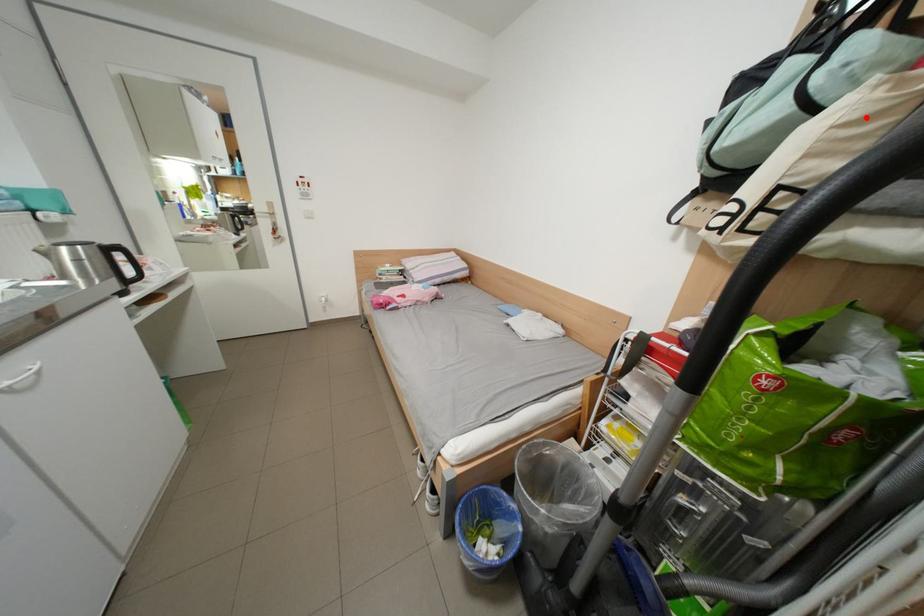
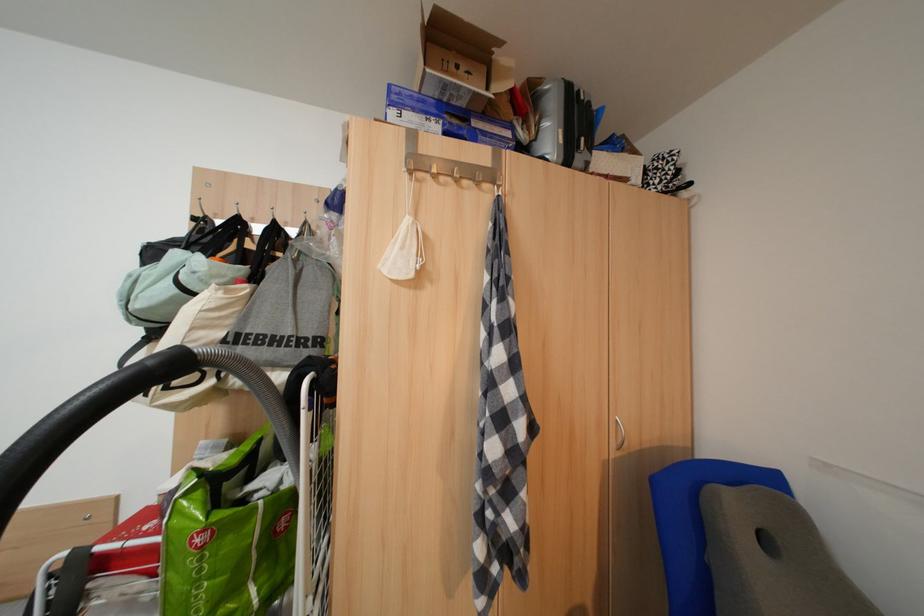
Where in the second image is the point corresponding to the highlighted location from the first image?

(224, 307)